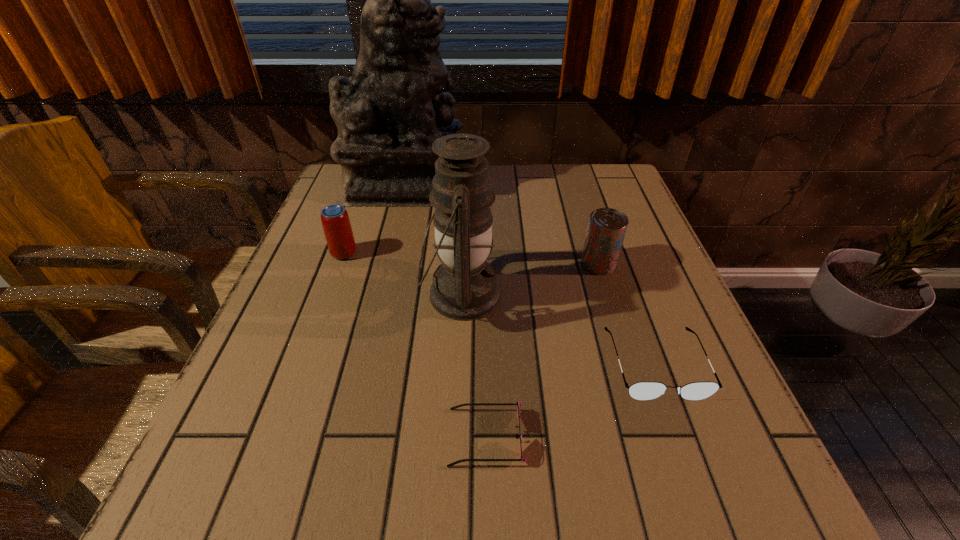
This screenshot has width=960, height=540. Identify the location of free spot that satisfies the following two spatial constraints: 1. on the back side of the right beer can; 2. on the front-facing side of the farthest object. (575, 185).

Find the location of a particular element. The width and height of the screenshot is (960, 540). vacant space that satisfies the following two spatial constraints: 1. on the lenses of the spectacles; 2. on the bridge of the shortest object is located at coordinates (682, 437).